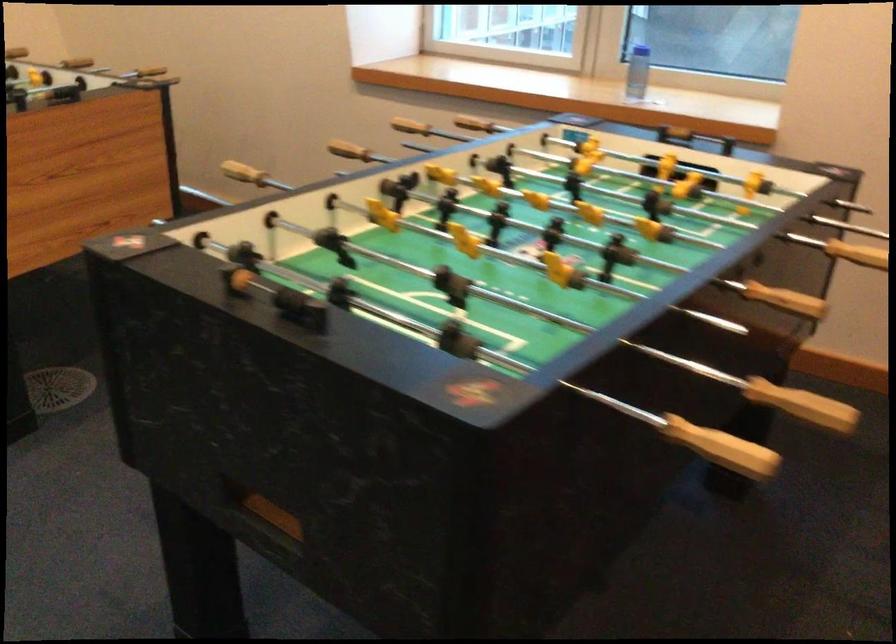
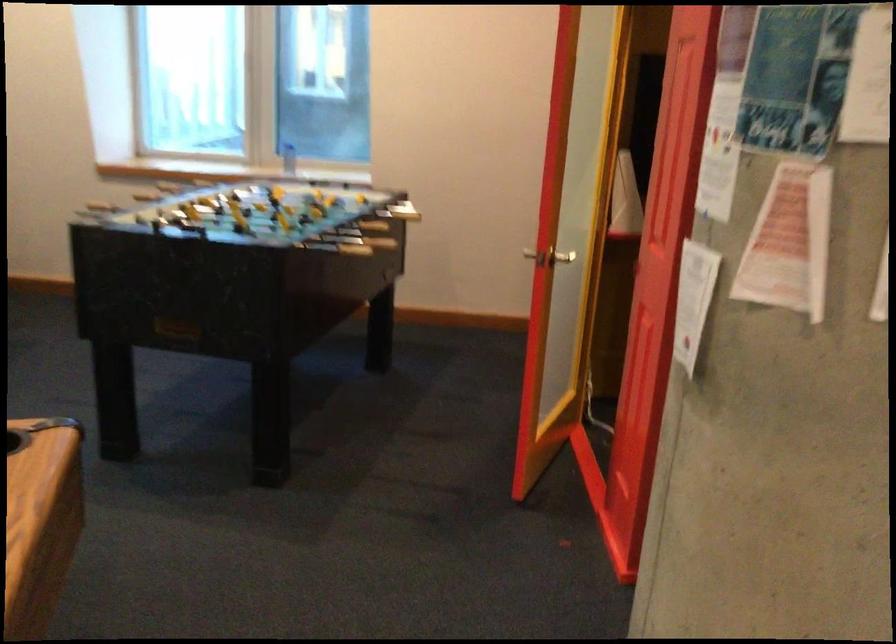
In the second image, find the point that corresponds to [348,149] in the first image.

(147, 187)